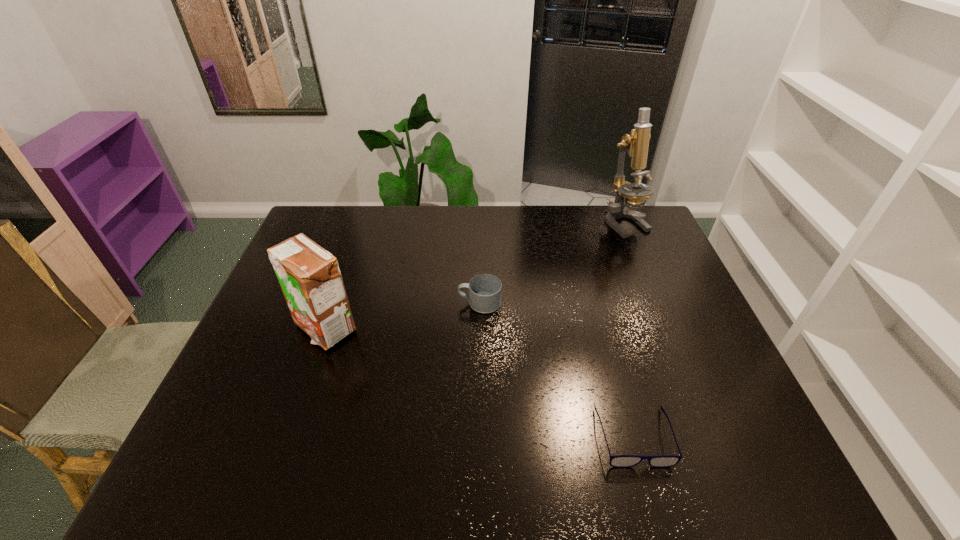
Locate an element on the screen. free space between the mug and the nearest object is located at coordinates (557, 370).

You are a GUI agent. You are given a task and a screenshot of the screen. Output one action in this format:
    pyautogui.click(x=<x>, y=<y>)
    Task: Click on the vacant region between the rightmost object and the shortest object
    Image resolution: width=960 pixels, height=540 pixels.
    Given the screenshot: What is the action you would take?
    pyautogui.click(x=629, y=329)

Point out which object is positioned as the third nearest to the second shortest object. Please provide its 2D coordinates. Your answer should be formatted as a tuple, i.e. [(x, y)], where the tuple contains the x and y coordinates of a point satisfying the conditions above.

[(636, 143)]

Find the location of a particular element. The height and width of the screenshot is (540, 960). the closest object to the shortest object is located at coordinates (485, 289).